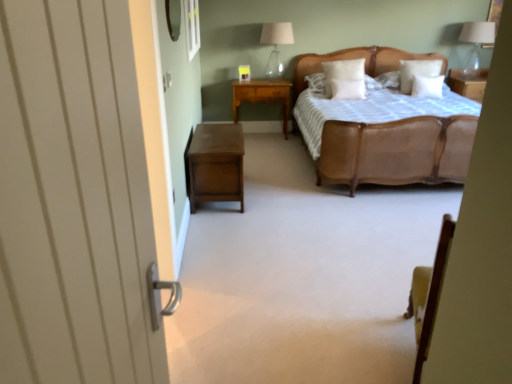
Where is `free space in front of light brown wood nightstand at center, which is counted as the 2th nightstand, starting from the bottom`? The height and width of the screenshot is (384, 512). free space in front of light brown wood nightstand at center, which is counted as the 2th nightstand, starting from the bottom is located at coordinates (270, 144).